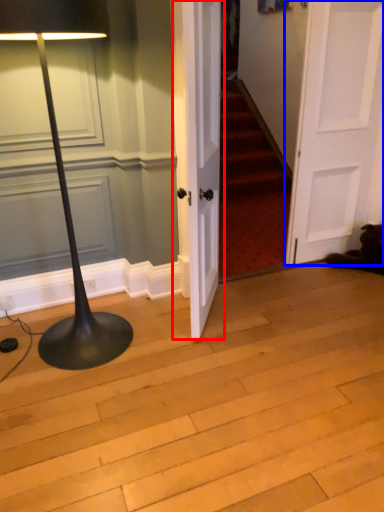
Question: Which object appears closest to the camera in this image, door (highlighted by a red box) or door (highlighted by a blue box)?

Choices:
 (A) door
 (B) door

Answer: (A)